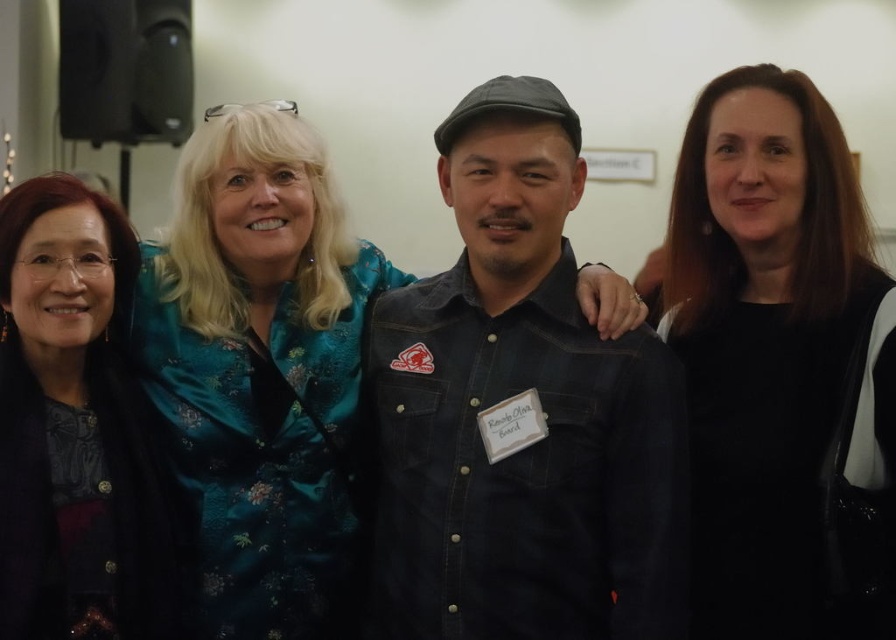
Question: Is denim shirt at center bigger than matte black jacket at left?

Choices:
 (A) no
 (B) yes

Answer: (B)

Question: Which point is closer to the camera?

Choices:
 (A) matte black jacket at left
 (B) black matte dress at center
 (C) denim shirt at center

Answer: (B)

Question: Is denim shirt at center further to the viewer compared to matte black jacket at left?

Choices:
 (A) no
 (B) yes

Answer: (A)

Question: Can you confirm if black matte dress at center is wider than matte black jacket at left?

Choices:
 (A) yes
 (B) no

Answer: (A)

Question: Which point is closer to the camera taking this photo?

Choices:
 (A) (108, 384)
 (B) (644, 588)

Answer: (B)

Question: Which of the following is the closest to the observer?

Choices:
 (A) black matte dress at center
 (B) matte black jacket at left

Answer: (A)